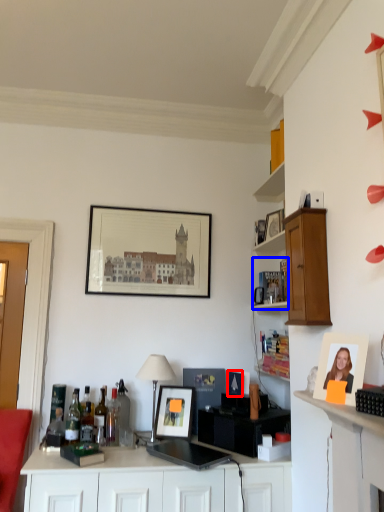
Question: Among these objects, which one is farthest to the camera, picture frame (highlighted by a red box) or shelf (highlighted by a blue box)?

Choices:
 (A) picture frame
 (B) shelf

Answer: (B)